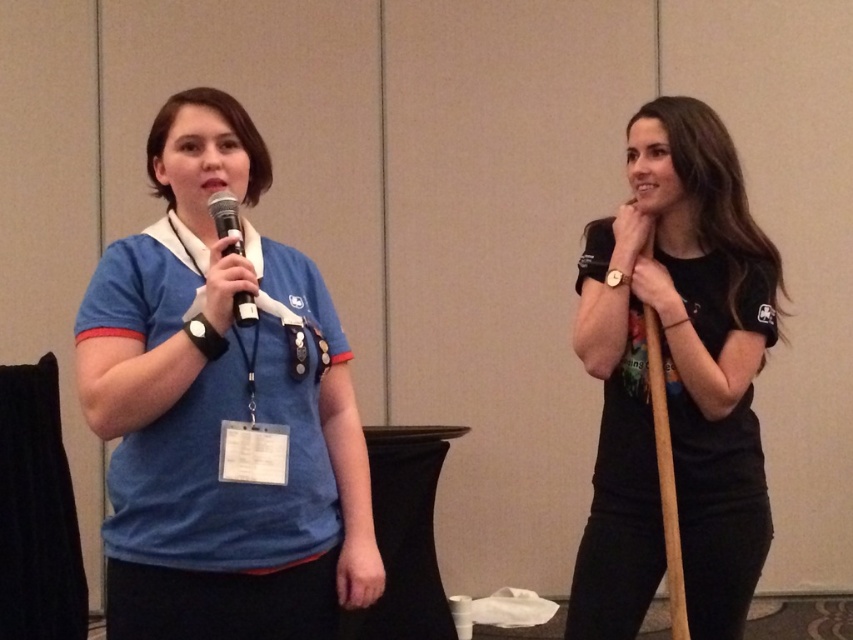
Does black matte shirt at right have a larger size compared to matte black microphone at left?

Indeed, black matte shirt at right has a larger size compared to matte black microphone at left.

Describe the element at coordinates (675, 378) in the screenshot. I see `black matte shirt at right` at that location.

The image size is (853, 640). Identify the location of black matte shirt at right. (675, 378).

The width and height of the screenshot is (853, 640). Identify the location of black matte shirt at right. (675, 378).

Is point (172, 566) positioned before point (643, 280)?

Yes, point (172, 566) is in front of point (643, 280).

Is blue fabric shirt at left positioned in front of black matte shirt at right?

Yes, it is in front of black matte shirt at right.

Identify the location of blue fabric shirt at left. (221, 412).

Can you confirm if blue fabric shirt at left is positioned below matte black microphone at left?

Yes.

Who is shorter, blue fabric shirt at left or matte black microphone at left?

matte black microphone at left is shorter.

Is point (219, 240) less distant than point (241, 232)?

Yes.

Locate an element on the screen. Image resolution: width=853 pixels, height=640 pixels. blue fabric shirt at left is located at coordinates (221, 412).